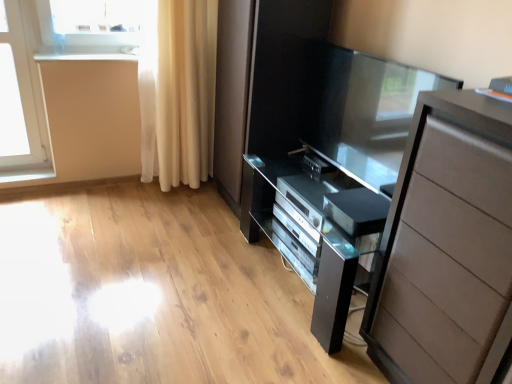
In order to click on vacant space situated above satin silver dvd player at lower center, the 1th appliance from the front (from a real-world perspective) in this screenshot , I will do `click(357, 202)`.